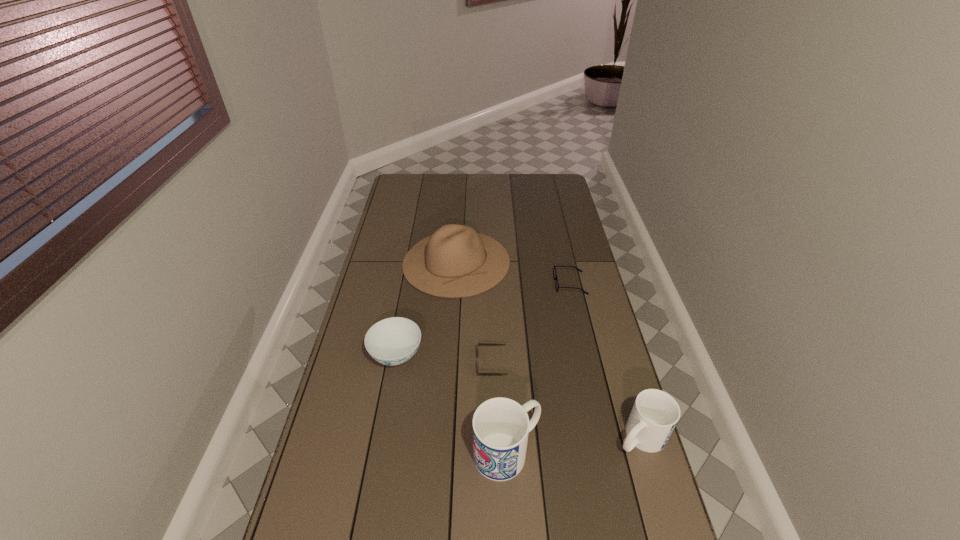
The height and width of the screenshot is (540, 960). What are the coordinates of `spectacles at the right edge` in the screenshot? It's located at (555, 275).

Locate an element on the screen. This screenshot has height=540, width=960. free spot at the far edge of the desktop is located at coordinates (472, 178).

Identify the location of free region at the near edge of the desktop. Image resolution: width=960 pixels, height=540 pixels. (501, 510).

You are a GUI agent. You are given a task and a screenshot of the screen. Output one action in this format:
    pyautogui.click(x=<x>, y=<y>)
    Task: Click on the free space at the left edge of the desktop
    
    Given the screenshot: What is the action you would take?
    pyautogui.click(x=397, y=264)

Where is `vacant area at the right edge of the desktop`? vacant area at the right edge of the desktop is located at coordinates (567, 334).

The image size is (960, 540). I want to click on free space between the right mug and the third shortest object, so click(x=518, y=396).

Find the location of a particular element. This screenshot has height=540, width=960. vacant point located between the chinaware and the fifth tallest object is located at coordinates (444, 360).

Where is `vacant area that lies between the sombrero and the fourth shortest object`? vacant area that lies between the sombrero and the fourth shortest object is located at coordinates (548, 349).

Where is `free space between the right mug and the fifth tallest object`? Image resolution: width=960 pixels, height=540 pixels. free space between the right mug and the fifth tallest object is located at coordinates (566, 400).

Find the location of `free space between the spectacles and the left mug`. free space between the spectacles and the left mug is located at coordinates (539, 368).